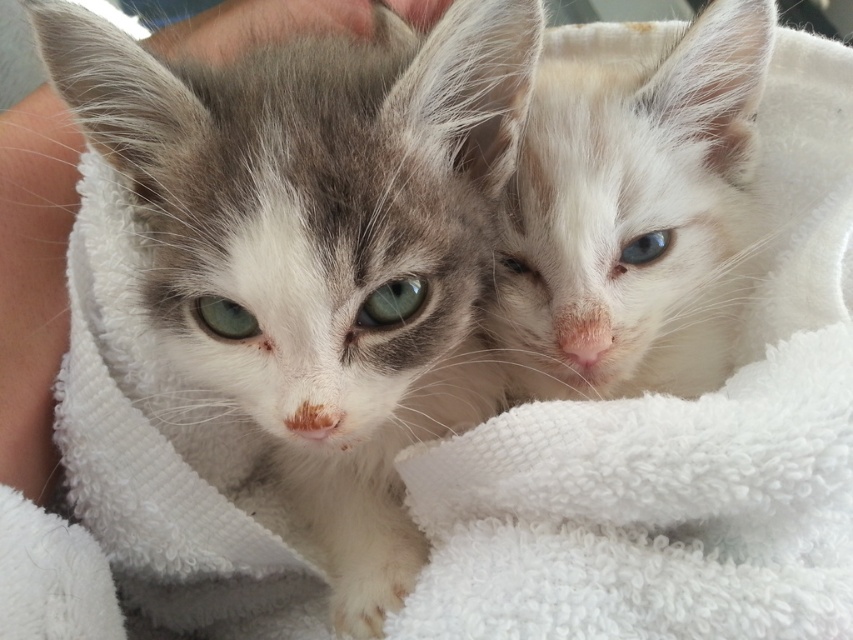
Question: Does white fluffy cat at upper right have a larger size compared to green glossy eye at center?

Choices:
 (A) no
 (B) yes

Answer: (B)

Question: Which object appears farthest from the camera in this image?

Choices:
 (A) blue glossy eye at upper right
 (B) soft gray fur kitten at left
 (C) white fluffy cat at upper right

Answer: (A)

Question: Is soft gray fur kitten at left below white fur eye at upper center?

Choices:
 (A) no
 (B) yes

Answer: (B)

Question: Among these objects, which one is nearest to the camera?

Choices:
 (A) green glossy eye at center
 (B) white fluffy cat at upper right
 (C) white fur eye at upper center

Answer: (A)

Question: Is soft gray fur kitten at left in front of white fur eye at upper center?

Choices:
 (A) yes
 (B) no

Answer: (A)

Question: Which point is closer to the camera?

Choices:
 (A) white fur eye at upper center
 (B) blue glossy eye at upper right
 (C) white fluffy cat at upper right
 (D) green matte eye at center

Answer: (D)